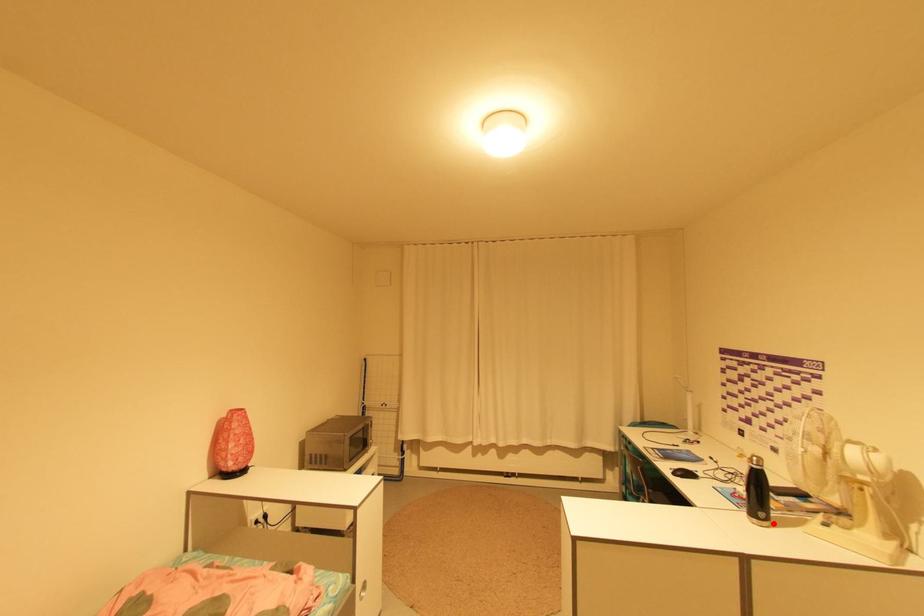
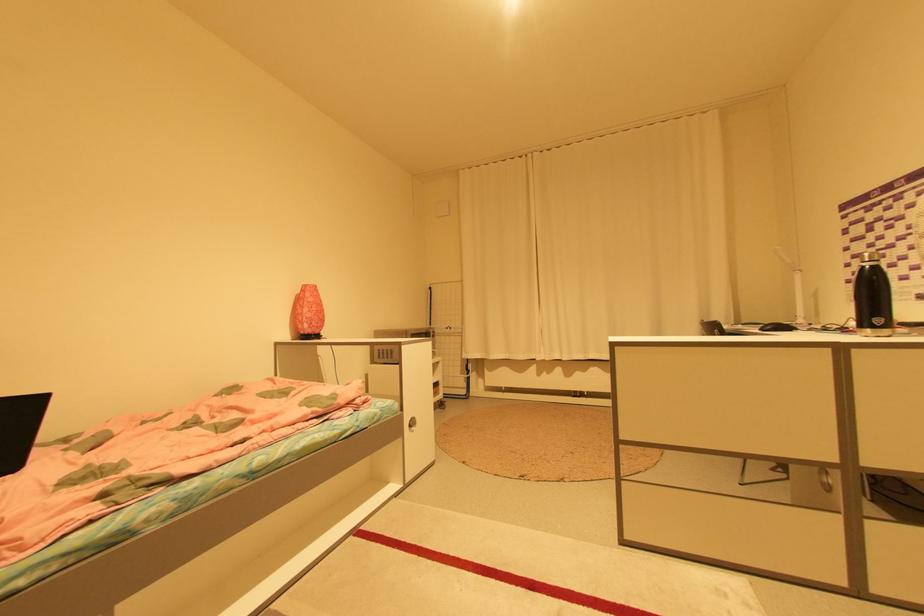
In the second image, find the point that corresponds to the highlighted location in the first image.

(893, 331)